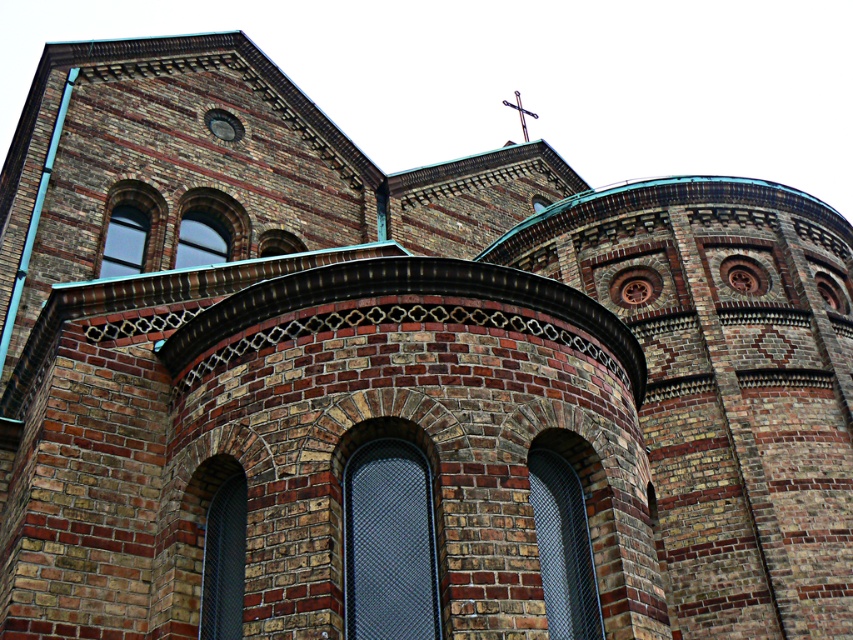
Question: Is dark gray mesh window at center smaller than metallic mesh window at center?

Choices:
 (A) yes
 (B) no

Answer: (B)

Question: Which object is positioned closest to the metallic cross at upper center?

Choices:
 (A) clear glass window at center
 (B) clear glass window at upper left
 (C) dark gray mesh window at center

Answer: (B)

Question: Can you confirm if metallic mesh window at center is positioned to the left of metallic cross at upper center?

Choices:
 (A) no
 (B) yes

Answer: (B)

Question: Is metallic mesh window at center to the left of metallic cross at upper center from the viewer's perspective?

Choices:
 (A) yes
 (B) no

Answer: (A)

Question: Which object is closer to the camera taking this photo?

Choices:
 (A) translucent glass window at upper left
 (B) metallic cross at upper center

Answer: (A)

Question: Which point is farther to the camera?

Choices:
 (A) metallic cross at upper center
 (B) dark gray mesh window at center
 (C) clear glass window at center

Answer: (A)